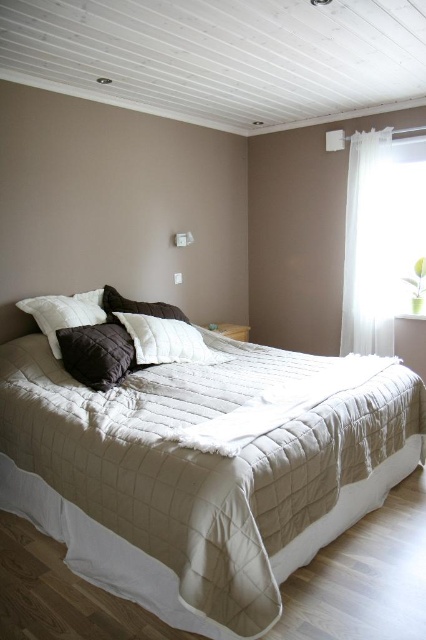
Question: Considering the relative positions of beige quilted bed at center and brown cotton pillow at center in the image provided, where is beige quilted bed at center located with respect to brown cotton pillow at center?

Choices:
 (A) right
 (B) left

Answer: (A)

Question: Among these objects, which one is nearest to the camera?

Choices:
 (A) white soft pillow at upper left
 (B) white sheer curtain at upper right
 (C) white quilted pillow at center
 (D) dark brown quilted pillow at center

Answer: (D)

Question: Which point is closer to the camera?

Choices:
 (A) dark brown quilted pillow at center
 (B) white soft pillow at upper left
 (C) beige quilted bed at center

Answer: (C)

Question: Is the position of dark brown quilted pillow at center more distant than that of white quilted pillow at center?

Choices:
 (A) yes
 (B) no

Answer: (B)

Question: Can you confirm if white quilted pillow at center is wider than brown cotton pillow at center?

Choices:
 (A) yes
 (B) no

Answer: (A)

Question: Which of the following is the closest to the observer?

Choices:
 (A) dark brown quilted pillow at center
 (B) white sheer curtain at upper right

Answer: (A)